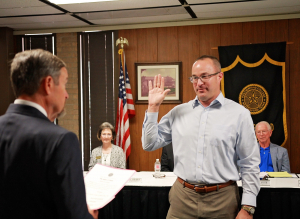
Locate an element on the screen. This screenshot has height=219, width=300. table is located at coordinates (161, 184).